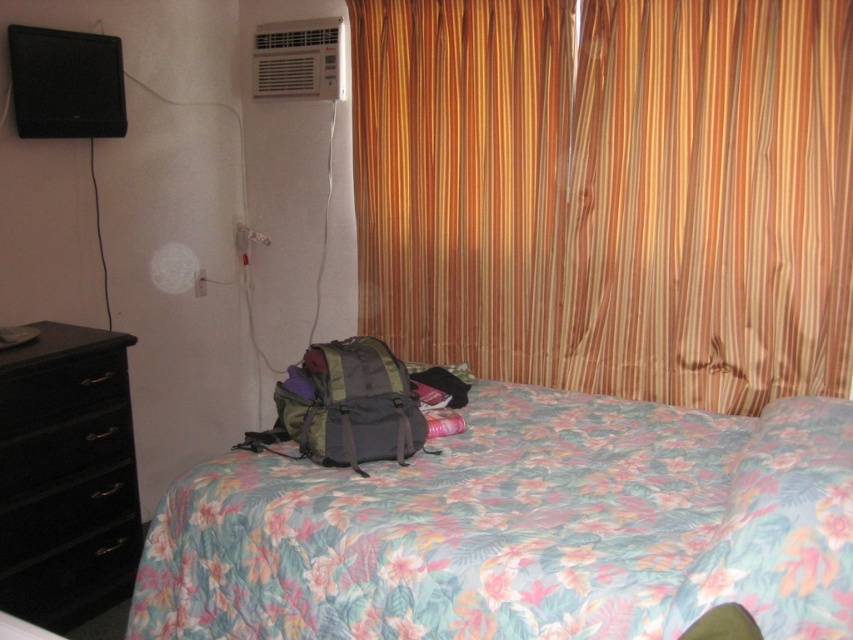
Question: Can you confirm if floral fabric pillow at lower right is thinner than black matte drawer at left?

Choices:
 (A) yes
 (B) no

Answer: (B)

Question: Which point appears closest to the camera in this image?

Choices:
 (A) [x=354, y=428]
 (B) [x=766, y=616]
 (C) [x=563, y=525]

Answer: (B)

Question: Is wooden striped curtain at center behind olive green fabric backpack at center?

Choices:
 (A) no
 (B) yes

Answer: (B)

Question: Considering the real-world distances, which object is closest to the black glossy drawer at lower left?

Choices:
 (A) wooden striped curtain at center
 (B) black matte drawer at left

Answer: (B)

Question: Is floral fabric pillow at lower right bigger than black glossy drawer at lower left?

Choices:
 (A) yes
 (B) no

Answer: (A)

Question: Which of these objects is positioned closest to the white plastic air conditioner at upper center?

Choices:
 (A) black glossy dresser at left
 (B) floral fabric bed at center
 (C) black matte drawer at left

Answer: (C)